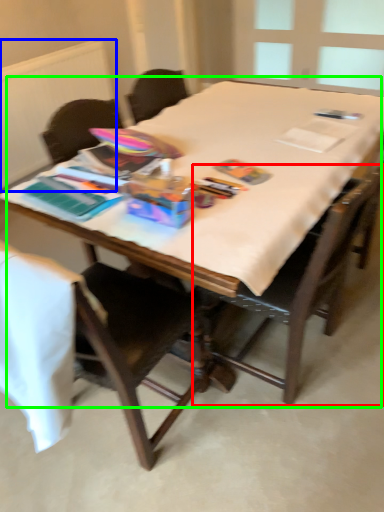
Question: Which object is positioned farthest from chair (highlighted by a red box)? Select from radiator (highlighted by a blue box) and table (highlighted by a green box).

Choices:
 (A) radiator
 (B) table

Answer: (A)